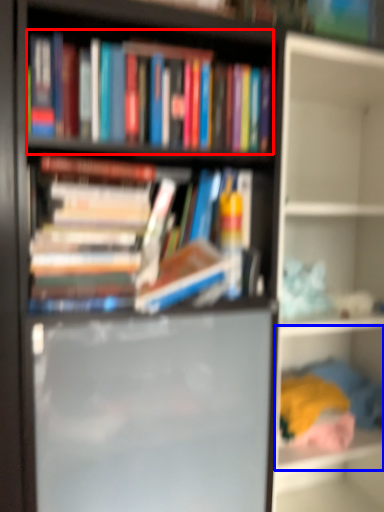
Question: Which of the following is the closest to the observer, book (highlighted by a red box) or shelf (highlighted by a blue box)?

Choices:
 (A) book
 (B) shelf

Answer: (A)